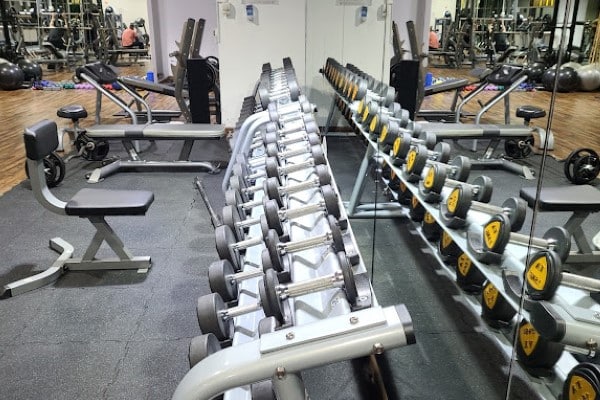
At what (x,y) coordinates should I click in order to perform the action: click on miiror. Please return your answer as a coordinate pair (x, y). The height and width of the screenshot is (400, 600). Looking at the image, I should click on [583, 180], [488, 63], [362, 40], [334, 22], [129, 7], [57, 21], [30, 17].